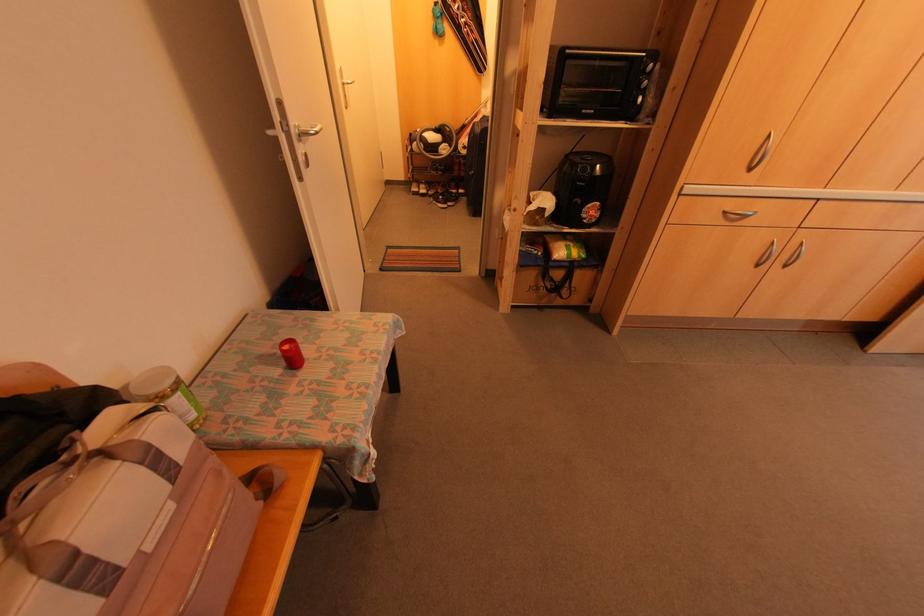
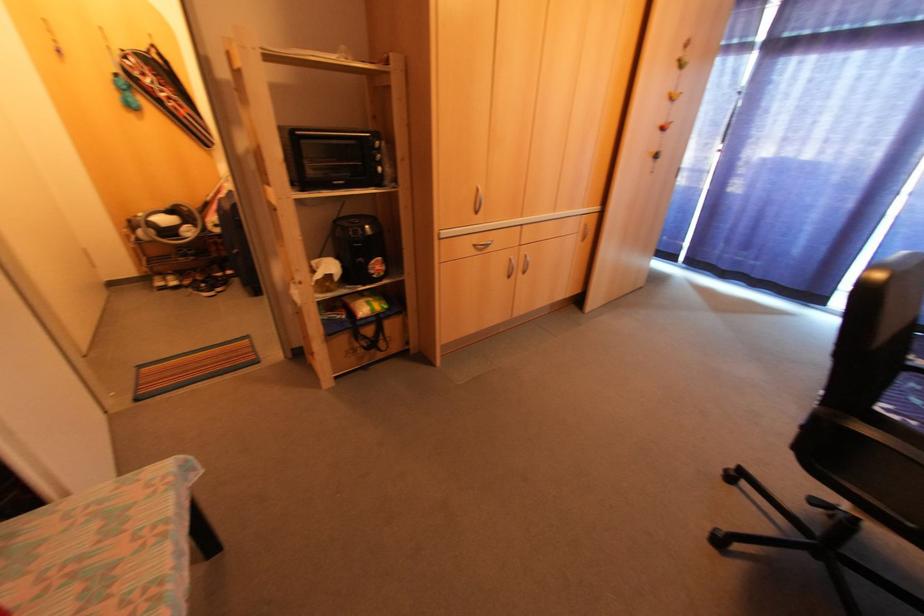
Find the pixel in the second image that matches the point at 748,169 in the first image.

(476, 213)